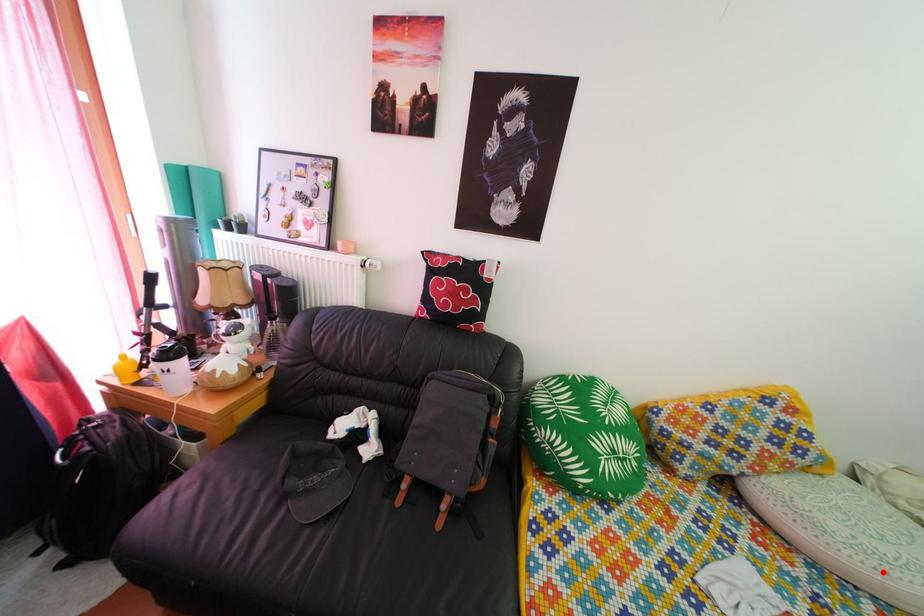
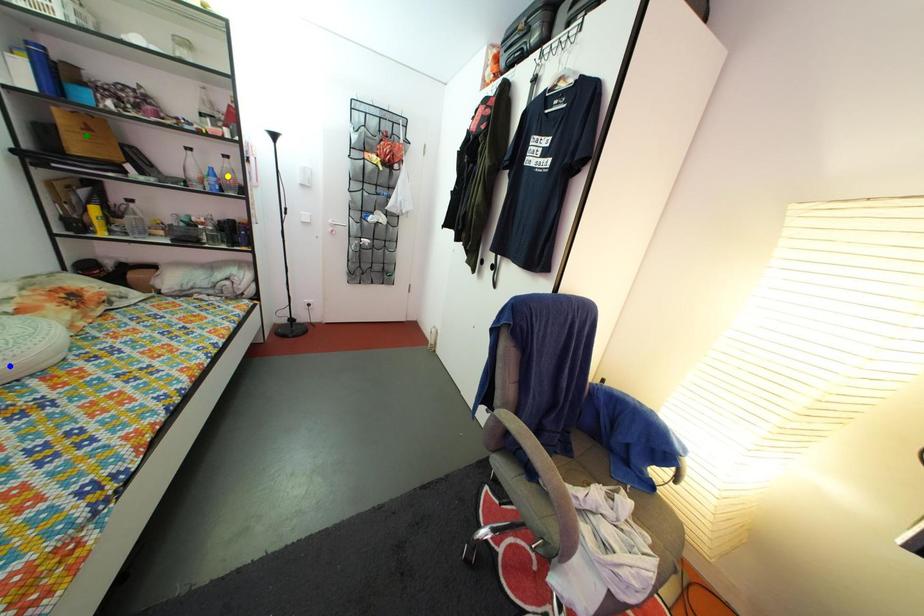
Question: I am providing you with two images of the same scene from different viewpoints. A red point is marked on the first image. You are given multiple points on the second image. Which point in image 2 represents the same 3d spot as the red point in image 1?

Choices:
 (A) green point
 (B) yellow point
 (C) blue point

Answer: (C)